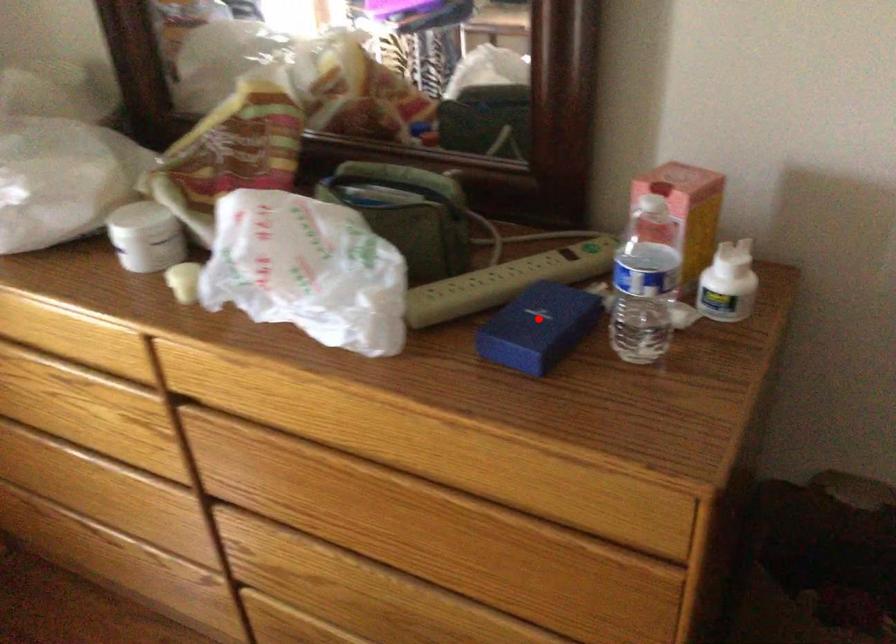
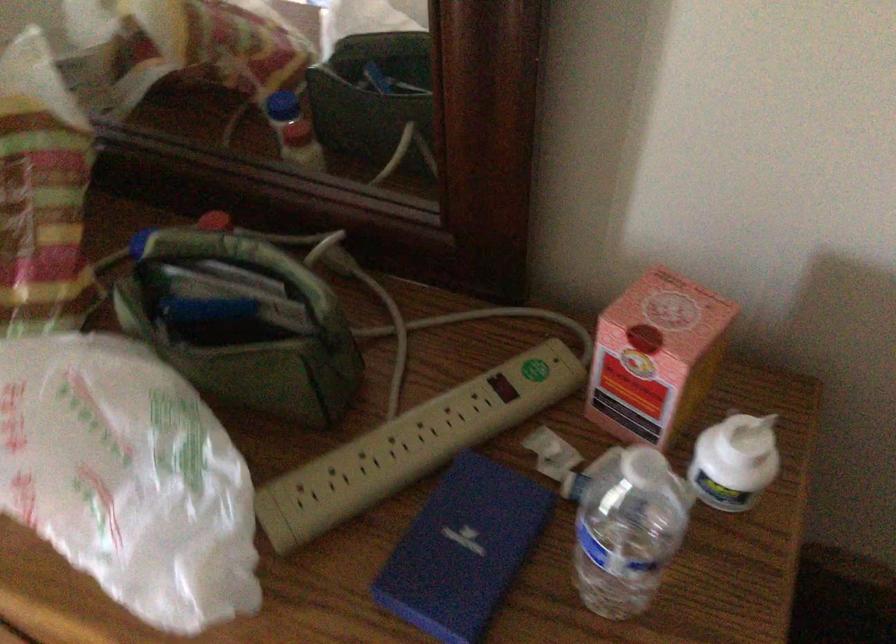
In the second image, find the point that corresponds to the highlighted location in the first image.

(462, 550)